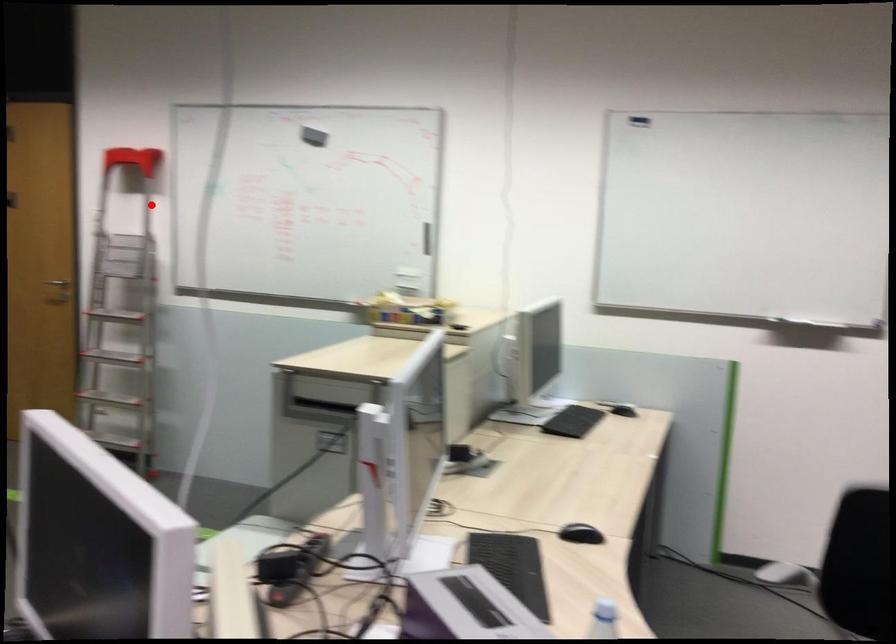
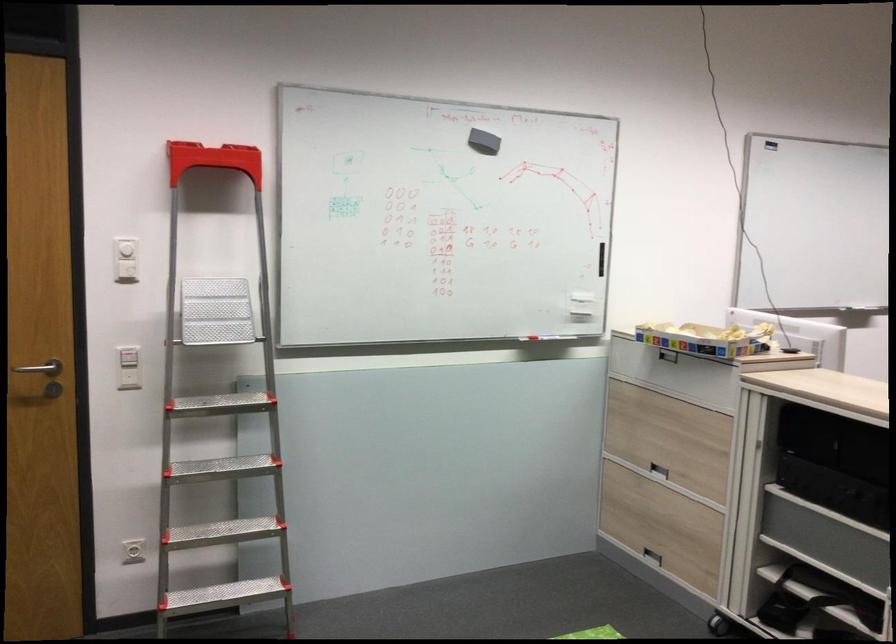
Question: I am providing you with two images of the same scene from different viewpoints. Image1 has a red point marked. In image2, the corresponding 3D location appears at what relative position? Reply with the corresponding letter.

Choices:
 (A) Closer
 (B) Farther

Answer: (A)